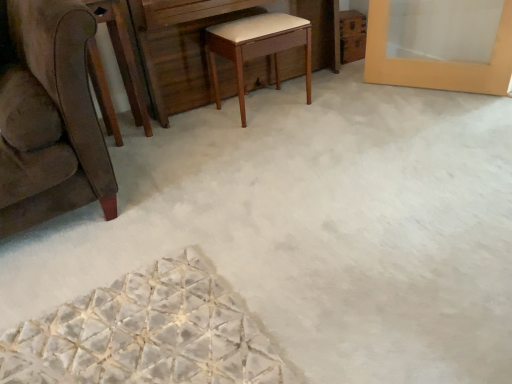
Where is `wooden vanity at center`? Image resolution: width=512 pixels, height=384 pixels. wooden vanity at center is located at coordinates (181, 47).

Find the location of `brown wood round table at left`. brown wood round table at left is located at coordinates (123, 57).

The width and height of the screenshot is (512, 384). What do you see at coordinates (256, 47) in the screenshot?
I see `light brown wood stool at center` at bounding box center [256, 47].

Identify the location of wooden vanity at center. pyautogui.click(x=181, y=47).

From the image's perspective, which is below, brown wood round table at left or light brown wood stool at center?

From the image's view, brown wood round table at left is below.

Does point (116, 14) come in front of point (216, 30)?

That is True.

Between brown wood round table at left and light brown wood stool at center, which one is positioned in front?

Positioned in front is brown wood round table at left.

Which object is thinner, wooden vanity at center or light brown wood stool at center?

With smaller width is light brown wood stool at center.

Based on their sizes in the image, would you say wooden vanity at center is bigger or smaller than light brown wood stool at center?

In the image, wooden vanity at center appears to be larger than light brown wood stool at center.

Consider the image. Who is taller, wooden vanity at center or light brown wood stool at center?

Standing taller between the two is wooden vanity at center.

Can you confirm if wooden vanity at center is positioned to the left of light brown wood stool at center?

Yes.

Considering the sizes of wooden vanity at center and brown wood round table at left in the image, is wooden vanity at center wider or thinner than brown wood round table at left?

Considering their sizes, wooden vanity at center looks broader than brown wood round table at left.

How different are the orientations of wooden vanity at center and brown wood round table at left in degrees?

2.44 degrees separate the facing orientations of wooden vanity at center and brown wood round table at left.

Is wooden vanity at center in front of or behind brown wood round table at left in the image?

wooden vanity at center is positioned farther from the viewer than brown wood round table at left.

From a real-world perspective, is wooden vanity at center under brown wood round table at left?

Yes, from a real-world perspective, wooden vanity at center is under brown wood round table at left.

Considering the positions of objects light brown wood stool at center and wooden vanity at center in the image provided, who is more to the left, light brown wood stool at center or wooden vanity at center?

From the viewer's perspective, wooden vanity at center appears more on the left side.

Considering the relative positions of light brown wood stool at center and wooden vanity at center in the image provided, is light brown wood stool at center in front of wooden vanity at center?

No, light brown wood stool at center is further to the viewer.

Is light brown wood stool at center turned away from wooden vanity at center?

Yes.

From the image's perspective, which is above, light brown wood stool at center or wooden vanity at center?

wooden vanity at center appears higher in the image.

From a real-world perspective, is light brown wood stool at center beneath brown wood round table at left?

Yes, from a real-world perspective, light brown wood stool at center is beneath brown wood round table at left.

Which of these two, light brown wood stool at center or brown wood round table at left, is thinner?

brown wood round table at left is thinner.

Is point (278, 31) positioned in front of point (123, 74)?

That is True.

Can you see brown wood round table at left touching wooden vanity at center?

No.

Consider the image. Which object is closer to the camera, brown wood round table at left or wooden vanity at center?

brown wood round table at left is more forward.

In the scene shown: Is brown wood round table at left at the right side of wooden vanity at center?

Incorrect, brown wood round table at left is not on the right side of wooden vanity at center.

The width and height of the screenshot is (512, 384). What are the coordinates of `table behind the brown wood round table at left` in the screenshot? It's located at click(256, 47).

Where is `table on the right of wooden vanity at center`? This screenshot has width=512, height=384. table on the right of wooden vanity at center is located at coordinates (256, 47).

Looking at the image, which one is located further to light brown wood stool at center, brown wood round table at left or wooden vanity at center?

The object further to light brown wood stool at center is brown wood round table at left.

Which object lies nearer to the anchor point wooden vanity at center, brown wood round table at left or light brown wood stool at center?

light brown wood stool at center is closer to wooden vanity at center.

Based on their spatial positions, is light brown wood stool at center or brown wood round table at left further from wooden vanity at center?

brown wood round table at left.

Considering their positions, is wooden vanity at center positioned further to light brown wood stool at center than brown wood round table at left?

brown wood round table at left.

Which object lies nearer to the anchor point brown wood round table at left, light brown wood stool at center or wooden vanity at center?

The object closer to brown wood round table at left is wooden vanity at center.

Which object lies nearer to the anchor point brown wood round table at left, wooden vanity at center or light brown wood stool at center?

Among the two, wooden vanity at center is located nearer to brown wood round table at left.

You are a GUI agent. You are given a task and a screenshot of the screen. Output one action in this format:
    pyautogui.click(x=<x>, y=<y>)
    Task: Click on the vanity located between brown wood round table at left and light brown wood stool at center in the left-right direction
    The height and width of the screenshot is (384, 512).
    Given the screenshot: What is the action you would take?
    pyautogui.click(x=181, y=47)